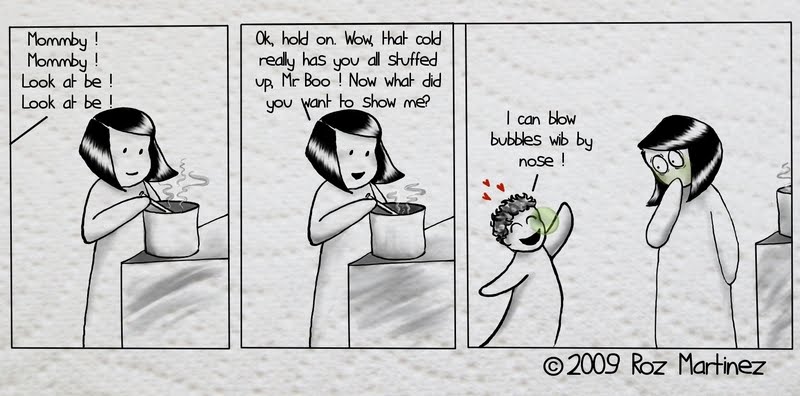
Locate an element on the screen. The width and height of the screenshot is (800, 396). stock pot is located at coordinates (169, 238), (412, 235), (788, 213).